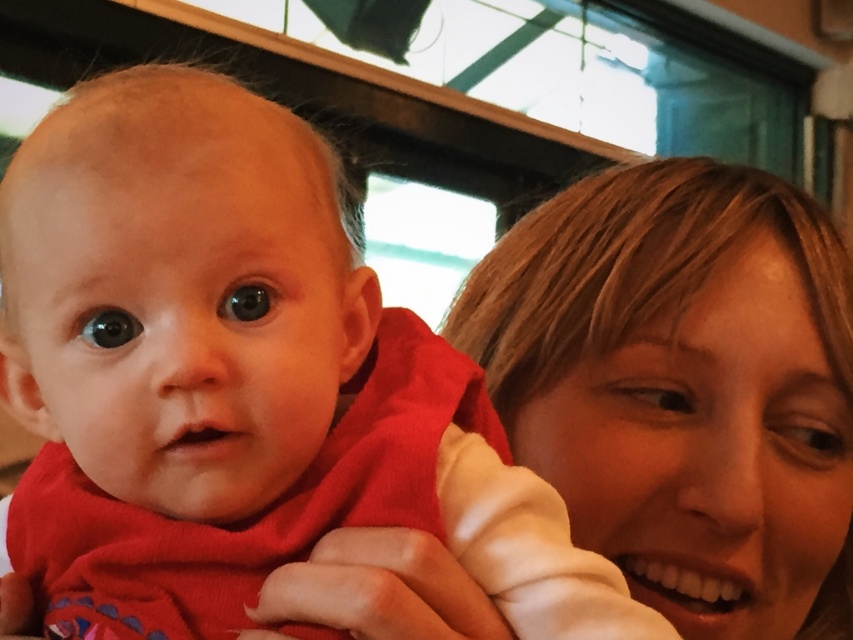
You are a photographer adjusting your camera focus. You need to focus on both the baby and the adult in the image. Which point, point [248,422] or point [664,253], should you focus on first to ensure the closer subject is sharp?

Point [248,422] is closer to the camera than point [664,253], so you should focus on point [248,422] first to ensure the closer subject is sharp.

You are a photographer trying to capture a close shot of the red soft baby at center and the smooth blonde hair at right. Which object is nearer to your camera lens?

The red soft baby at center is closer to the viewer than the smooth blonde hair at right, so the red soft baby at center will appear nearer to the camera lens.

You are a photographer adjusting your camera to capture the perfect shot of the red soft baby at center. According to the coordinates provided, where exactly should you focus your lens to ensure the baby is centered in the frame?

To center the red soft baby at center in the frame, focus your lens on the coordinates point at (236, 380) as that is the 2D location of the red soft baby at center.